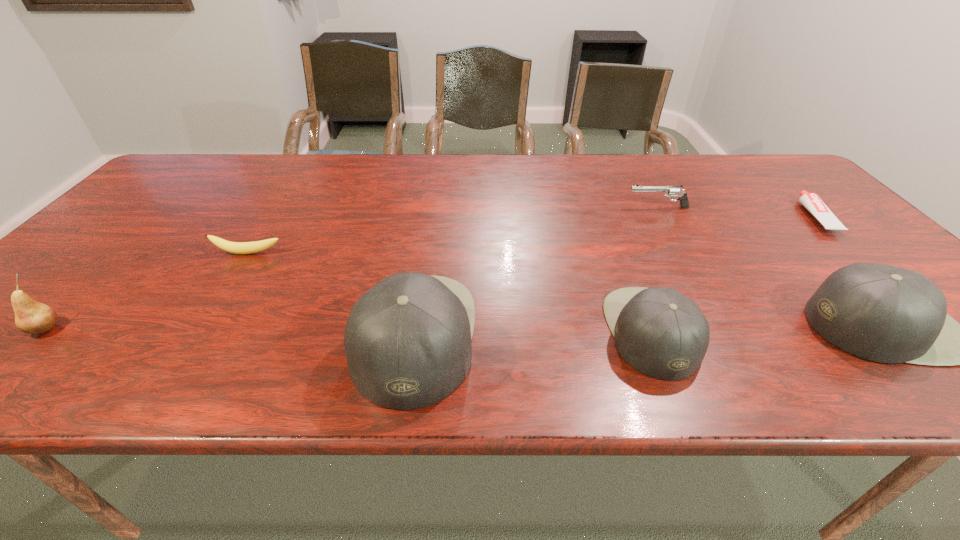
Please point a free position for a cap on the left. Please provide its 2D coordinates. Your answer should be formatted as a tuple, i.e. [(x, y)], where the tuple contains the x and y coordinates of a point satisfying the conditions above.

[(174, 341)]